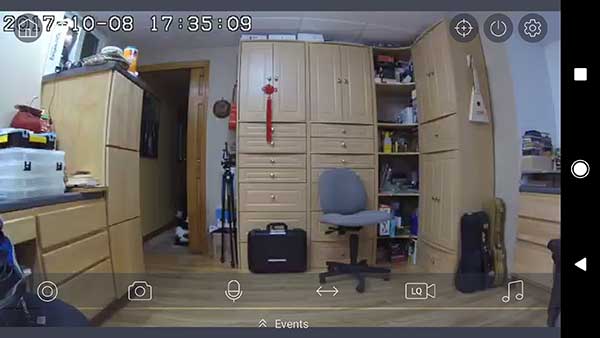
Where is `hard wood floors`? This screenshot has width=600, height=338. hard wood floors is located at coordinates (168, 247), (183, 296), (180, 317), (431, 316), (456, 296), (518, 324).